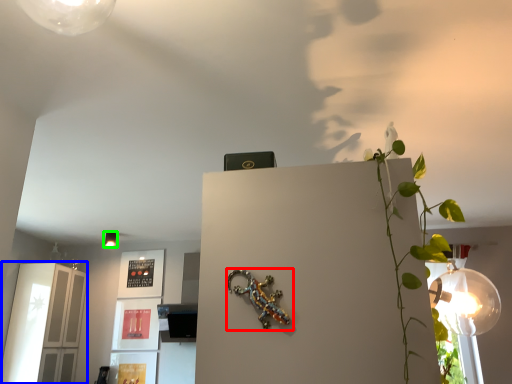
Question: Which is farther away from lizard (highlighted by a red box)? glass door (highlighted by a blue box) or lamp (highlighted by a green box)?

Choices:
 (A) glass door
 (B) lamp

Answer: (B)